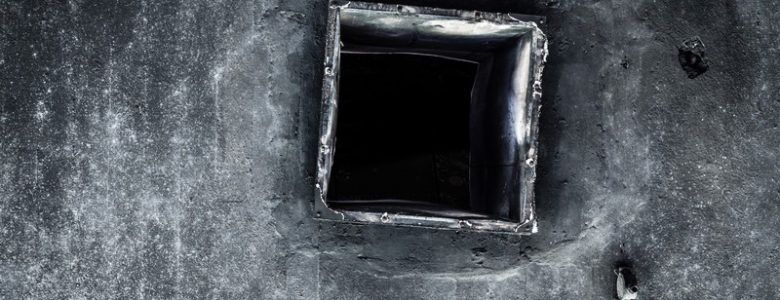
Locate an element on the screen. This screenshot has height=300, width=780. wall is located at coordinates (211, 185).